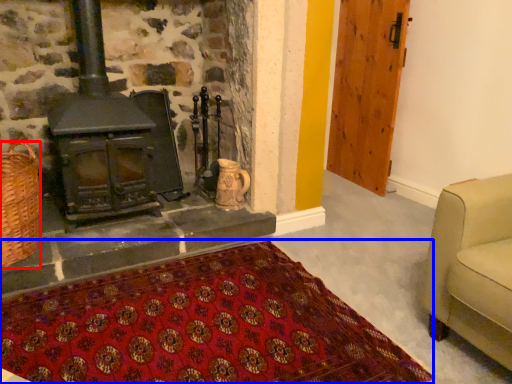
Question: Which object is closer to the camera taking this photo, basket (highlighted by a red box) or mat (highlighted by a blue box)?

Choices:
 (A) basket
 (B) mat

Answer: (B)